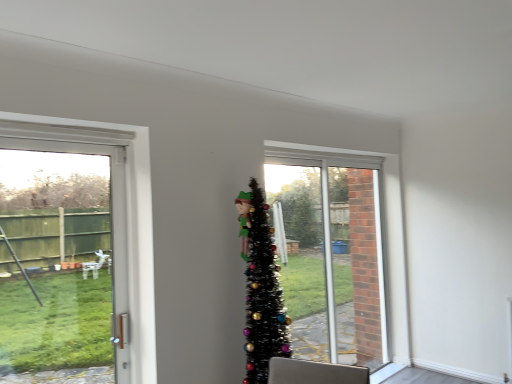
Question: Relative to white plastic door at left, is clear glass window at center in front or behind?

Choices:
 (A) front
 (B) behind

Answer: (B)

Question: Does point (325, 228) appear closer or farther from the camera than point (8, 337)?

Choices:
 (A) farther
 (B) closer

Answer: (A)

Question: Which is farther from the black tinsel christmas tree at center?

Choices:
 (A) clear glass window at center
 (B) white plastic door at left

Answer: (B)

Question: Which object is positioned farthest from the clear glass window at center?

Choices:
 (A) black tinsel christmas tree at center
 (B) white plastic door at left

Answer: (B)